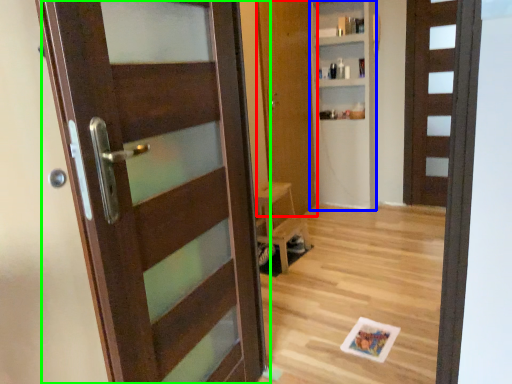
Question: Which is farther away from door (highlighted by a red box)? bookshelf (highlighted by a blue box) or door (highlighted by a green box)?

Choices:
 (A) bookshelf
 (B) door

Answer: (B)